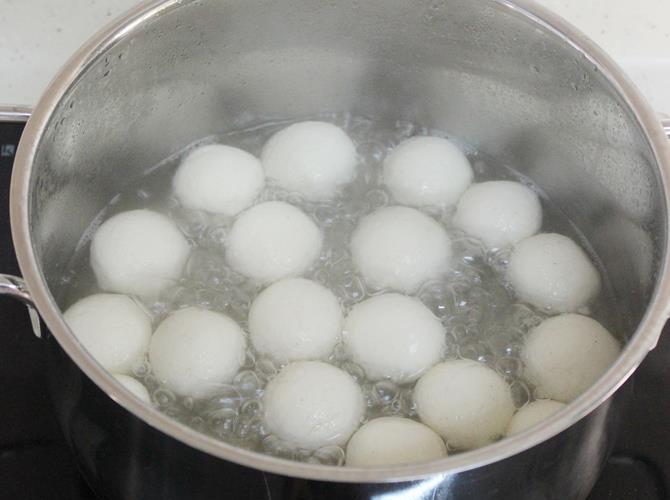
The height and width of the screenshot is (500, 670). I want to click on rim of pan, so click(x=25, y=235).